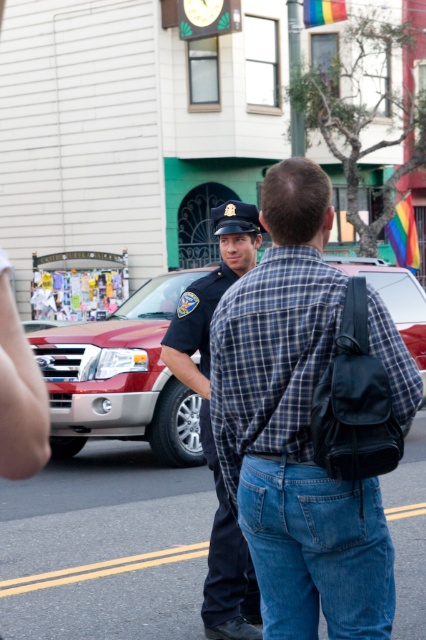
Question: Observing the image, what is the correct spatial positioning of blue plaid shirt at center in reference to dark blue uniform at center?

Choices:
 (A) above
 (B) below

Answer: (A)

Question: Which of the following is the farthest from the observer?

Choices:
 (A) (190, 456)
 (B) (284, 200)
 (C) (57, 381)
 (D) (233, 548)

Answer: (A)

Question: Does blue plaid shirt at center have a larger size compared to metallic red suv at center-left?

Choices:
 (A) no
 (B) yes

Answer: (A)

Question: Which point appears closest to the camera in this image?

Choices:
 (A) (60, 404)
 (B) (371, 524)
 (C) (382, 291)
 (D) (226, 237)

Answer: (B)

Question: Does blue plaid shirt at center have a smaller size compared to metallic red suv at center-left?

Choices:
 (A) no
 (B) yes

Answer: (B)

Question: Which point appears closest to the camera in this image?

Choices:
 (A) (118, 337)
 (B) (233, 376)

Answer: (B)